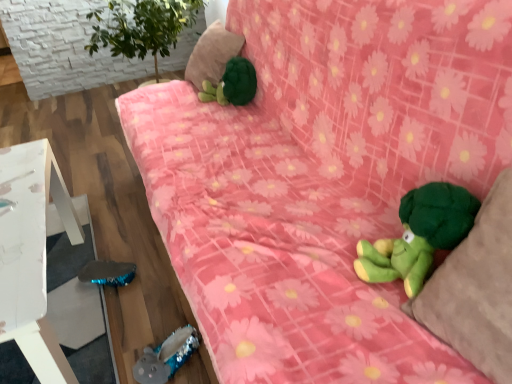
Question: Is green plush at upper center, which is the first pillow in top-to-bottom order, inside the boundaries of shiny blue plush toy at lower left, which is the 1th toy from bottom to top, or outside?

Choices:
 (A) inside
 (B) outside

Answer: (B)

Question: Looking at their shapes, would you say green plush at upper center, the first pillow when ordered from back to front, is wider or thinner than shiny blue plush toy at lower left, which is the third toy in right-to-left order?

Choices:
 (A) thin
 (B) wide

Answer: (B)

Question: Estimate the real-world distances between objects in this image. Which object is closer to the green plush turtle at upper center, the 1th toy when ordered from top to bottom?

Choices:
 (A) green plush toy at lower right, positioned as the third toy in back-to-front order
 (B) white painted wood table at lower left
 (C) shiny blue plush toy at lower left, which appears as the 2th toy when viewed from the back
 (D) green plush at upper center, placed as the 1th pillow when sorted from left to right
 (E) green plush pillow at right, acting as the 2th pillow starting from the left

Answer: (D)

Question: Based on their relative distances, which object is farther from the green plush pillow at right, which is the first pillow in front-to-back order?

Choices:
 (A) green plush turtle at upper center, positioned as the 2th toy in left-to-right order
 (B) shiny blue plush toy at lower left, which is the third toy in right-to-left order
 (C) green plush at upper center, which ranks as the 2th pillow in right-to-left order
 (D) white painted wood table at lower left
 (E) green plush toy at lower right, the second toy viewed from the top

Answer: (C)